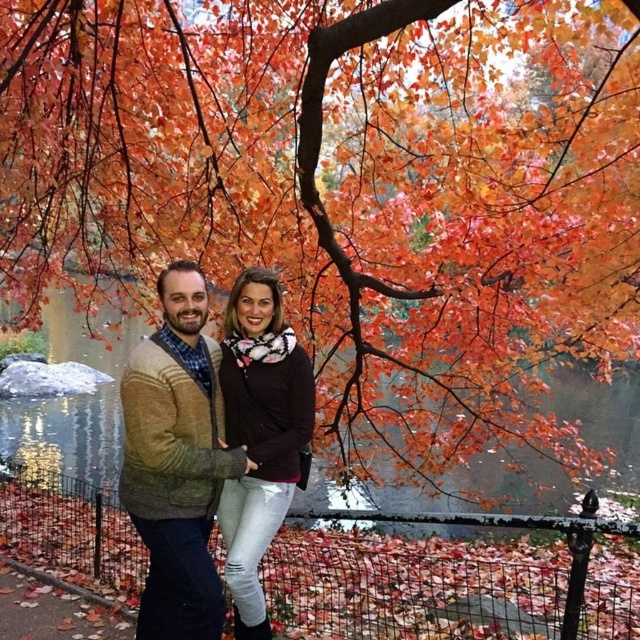
Question: Among these objects, which one is farthest from the camera?

Choices:
 (A) matte black sweater at center
 (B) knit sweater at center

Answer: (A)

Question: Is knit sweater at center below matte black sweater at center?

Choices:
 (A) no
 (B) yes

Answer: (B)

Question: Which object is closer to the camera taking this photo?

Choices:
 (A) matte black sweater at center
 (B) knit sweater at center

Answer: (B)

Question: Does knit sweater at center appear on the left side of matte black sweater at center?

Choices:
 (A) no
 (B) yes

Answer: (B)

Question: In this image, where is knit sweater at center located relative to matte black sweater at center?

Choices:
 (A) above
 (B) below

Answer: (B)

Question: Which of the following is the farthest from the observer?

Choices:
 (A) knit sweater at center
 (B) matte black sweater at center

Answer: (B)